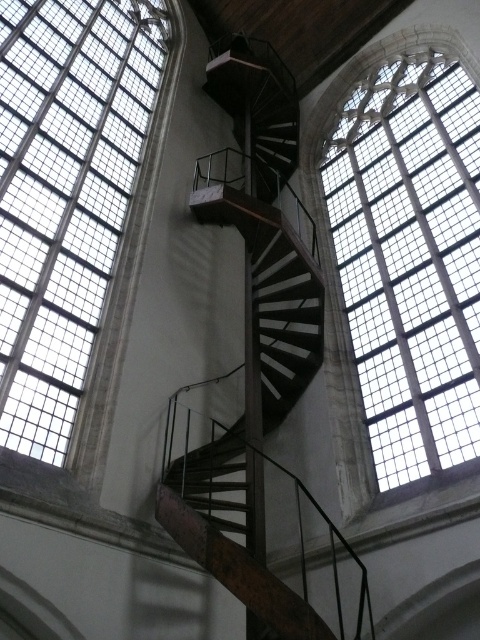
Is clear glass window at upper left thinner than clear glass window at upper right?

Yes.

Locate an element on the screen. clear glass window at upper left is located at coordinates (64, 193).